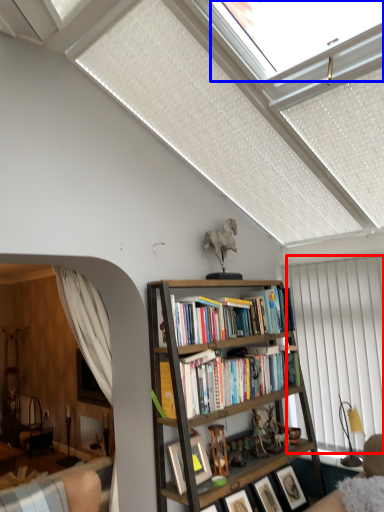
Question: Which object appears farthest to the camera in this image, curtain (highlighted by a red box) or window (highlighted by a blue box)?

Choices:
 (A) curtain
 (B) window

Answer: (A)